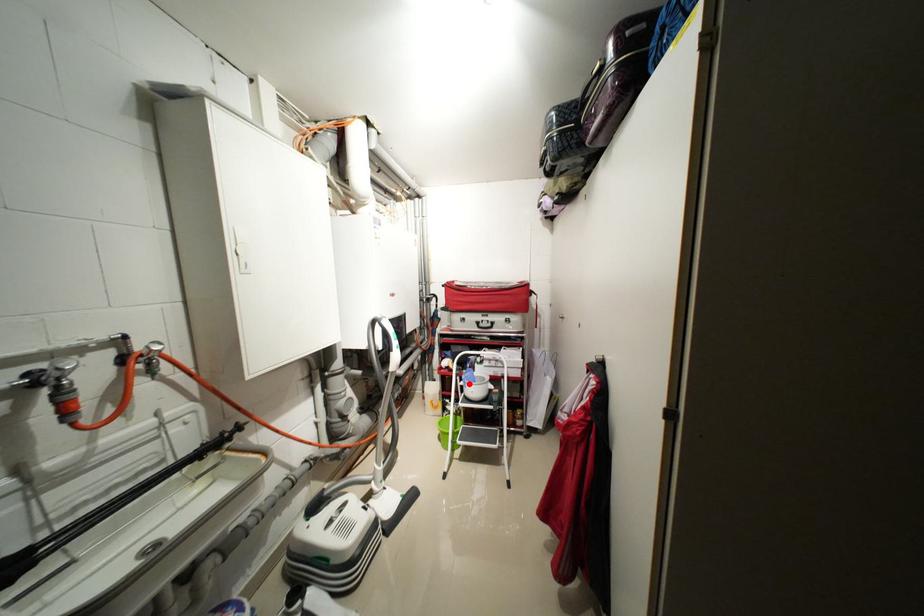
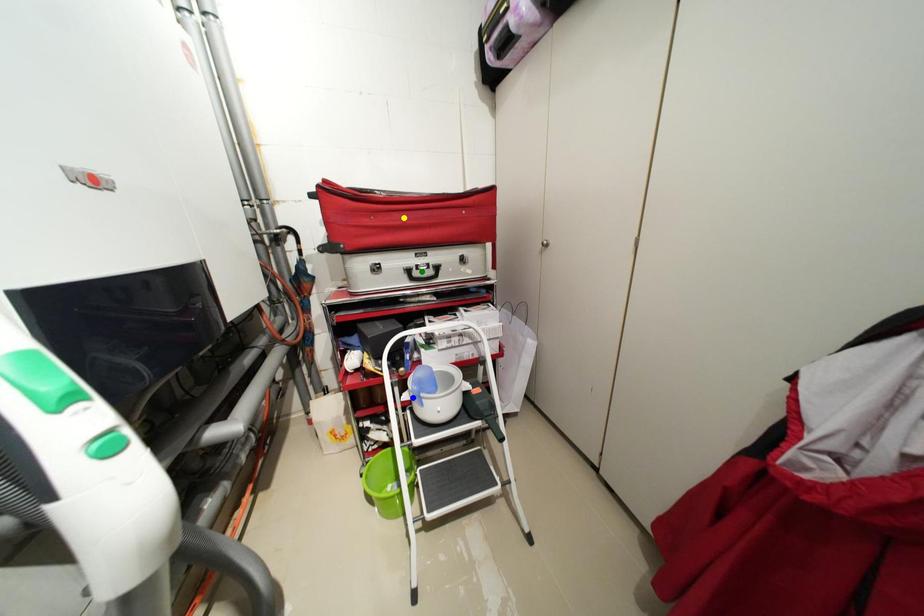
Question: I am providing you with two images of the same scene from different viewpoints. A red point is marked on the first image. You are given multiple points on the second image. Which point in image 2 is actually the same real-world point as the red point in image 1?

Choices:
 (A) green point
 (B) blue point
 (C) yellow point

Answer: (B)